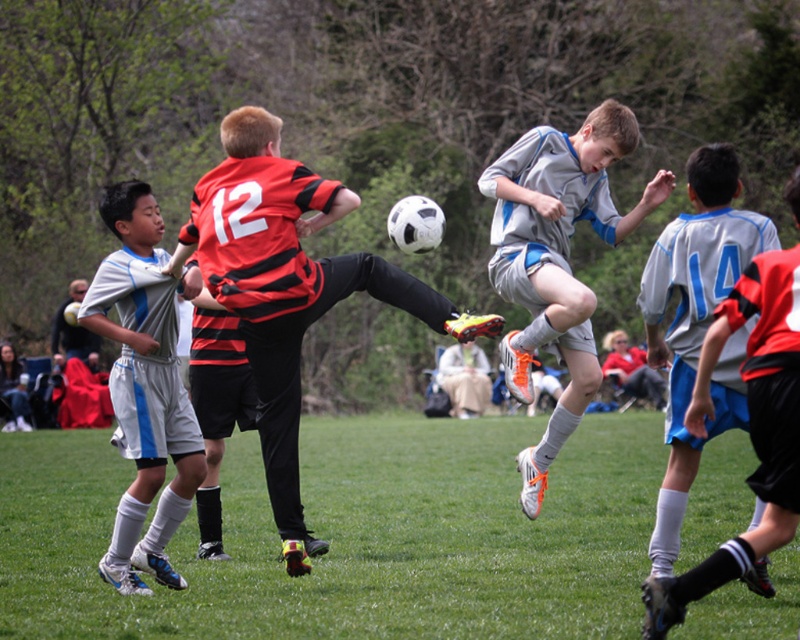
Question: Does red and black striped jersey at center have a smaller size compared to white matte soccer uniform at left?

Choices:
 (A) yes
 (B) no

Answer: (B)

Question: Can you confirm if blue jersey at center is smaller than matte gray jacket at left?

Choices:
 (A) no
 (B) yes

Answer: (A)

Question: In this image, where is red and black striped jersey at center located relative to gray/blue jersey at center?

Choices:
 (A) above
 (B) below

Answer: (B)

Question: Which of these objects is positioned farthest from the matte gray jacket at left?

Choices:
 (A) blue jersey at center
 (B) green grass at center
 (C) white matte soccer uniform at left

Answer: (C)

Question: Which object is positioned farthest from the matte gray jacket at left?

Choices:
 (A) green grass at center
 (B) gray/blue jersey at center

Answer: (B)

Question: Which object is the closest to the green grass at center?

Choices:
 (A) red and black striped jersey at center
 (B) gray/blue jersey at right
 (C) matte gray jacket at left

Answer: (A)